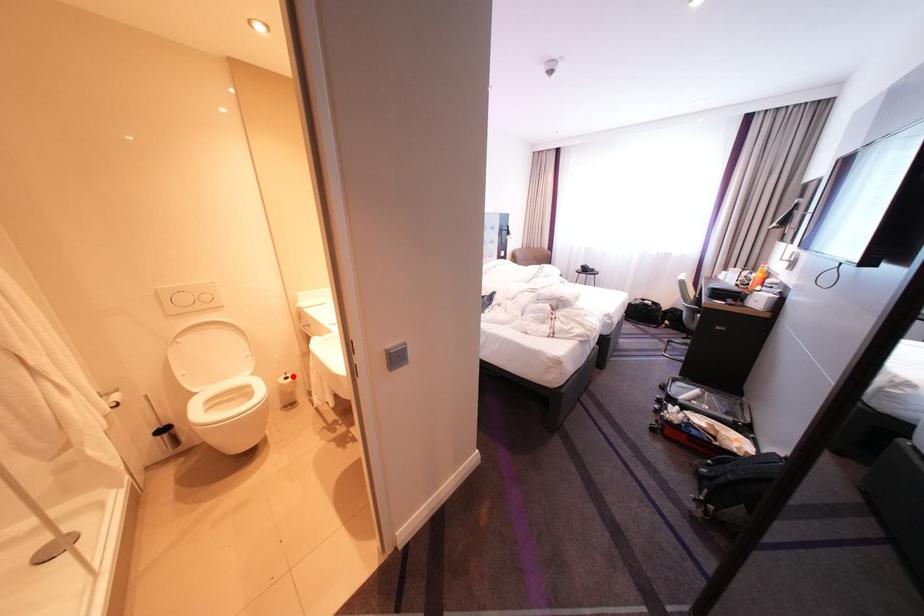
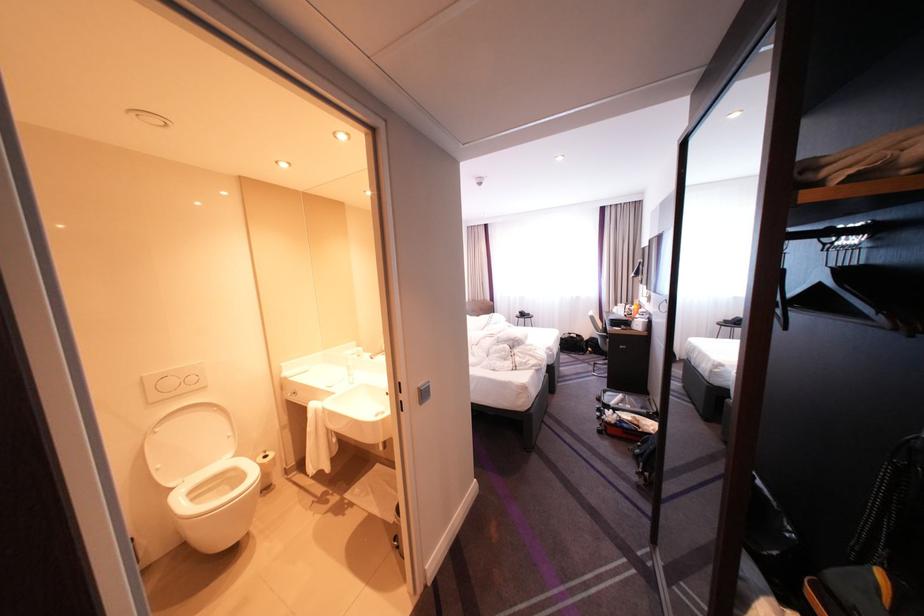
Question: I am providing you with two images of the same scene from different viewpoints. Given a red point in image1, look at the same physical point in image2. Is it:

Choices:
 (A) Closer to the viewpoint
 (B) Farther from the viewpoint

Answer: (A)